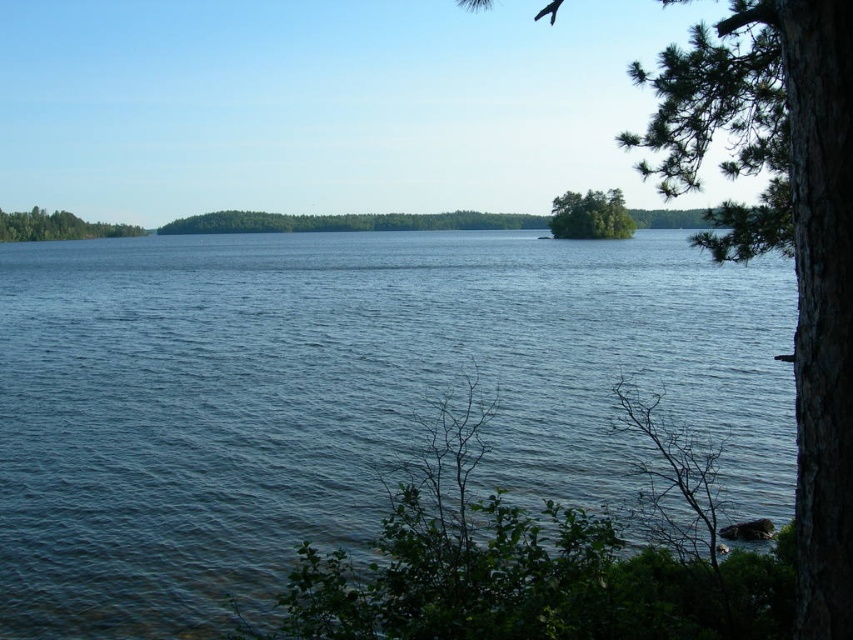
Which of these two, green leafy tree at center or green leafy island at center, stands shorter?

With less height is green leafy tree at center.

Describe the element at coordinates (347, 221) in the screenshot. The width and height of the screenshot is (853, 640). I see `green leafy tree at center` at that location.

Where is `green leafy tree at center`? green leafy tree at center is located at coordinates (347, 221).

Is point (383, 221) less distant than point (57, 236)?

No, it is not.

Is green leafy tree at center above green leafy tree at left?

Actually, green leafy tree at center is below green leafy tree at left.

Does point (184, 232) come behind point (138, 236)?

No, it is not.

You are a GUI agent. You are given a task and a screenshot of the screen. Output one action in this format:
    pyautogui.click(x=<x>, y=<y>)
    Task: Click on the green leafy tree at center
    This screenshot has height=640, width=853.
    Given the screenshot: What is the action you would take?
    pyautogui.click(x=347, y=221)

Between blue water at center and green leafy island at center, which one appears on the left side from the viewer's perspective?

blue water at center is more to the left.

I want to click on blue water at center, so click(x=339, y=397).